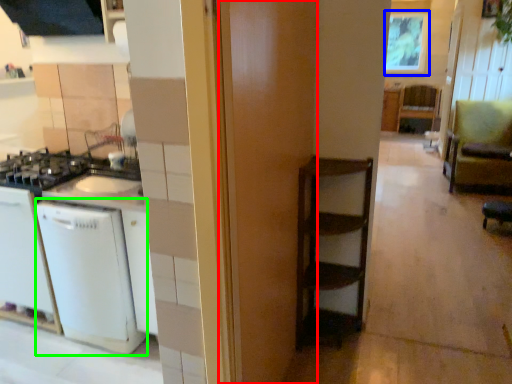
Question: Based on their relative distances, which object is farther from door (highlighted by a red box)? Choose from window screen (highlighted by a blue box) and dish washer (highlighted by a green box).

Choices:
 (A) window screen
 (B) dish washer

Answer: (A)